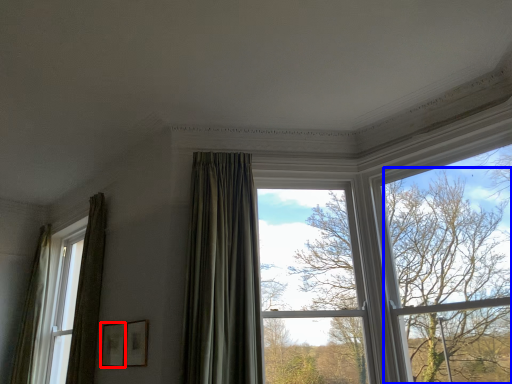
Question: Which object appears farthest to the camera in this image, picture frame (highlighted by a red box) or tree (highlighted by a blue box)?

Choices:
 (A) picture frame
 (B) tree

Answer: (A)